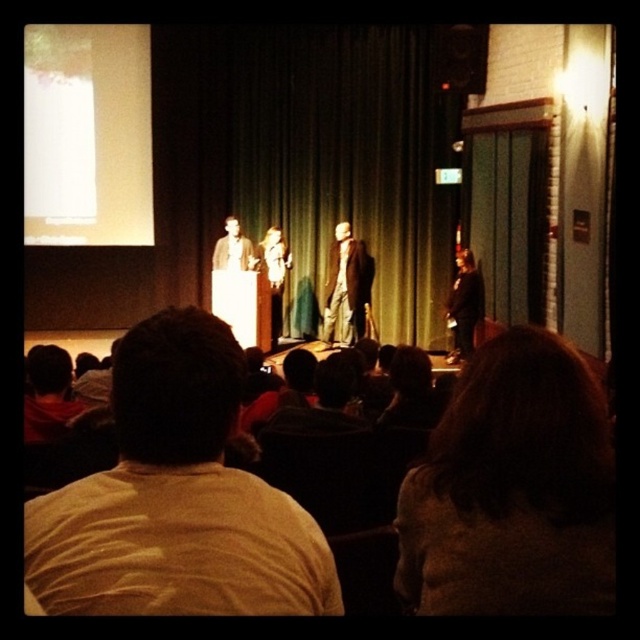
Between dark fabric jacket at center and matte brown suit at center, which one is positioned lower?

dark fabric jacket at center

Does dark fabric jacket at center have a smaller size compared to matte brown suit at center?

No.

Between point (454, 284) and point (230, 259), which one is positioned in front?

Point (454, 284) is more forward.

This screenshot has width=640, height=640. Find the location of `dark fabric jacket at center`. dark fabric jacket at center is located at coordinates (464, 305).

Who is positioned more to the right, dark brown hair at center or matte brown suit at center?

dark brown hair at center

Does dark brown hair at center appear over matte brown suit at center?

Actually, dark brown hair at center is below matte brown suit at center.

Which is in front, point (544, 404) or point (237, 256)?

Positioned in front is point (544, 404).

The image size is (640, 640). Find the location of `dark brown hair at center`. dark brown hair at center is located at coordinates point(513,490).

Which of these two, green fabric curtain at center or light beige shirt at center, stands shorter?

Standing shorter between the two is light beige shirt at center.

Does green fabric curtain at center have a smaller size compared to light beige shirt at center?

Indeed, green fabric curtain at center has a smaller size compared to light beige shirt at center.

The width and height of the screenshot is (640, 640). What are the coordinates of `green fabric curtain at center` in the screenshot? It's located at (307, 156).